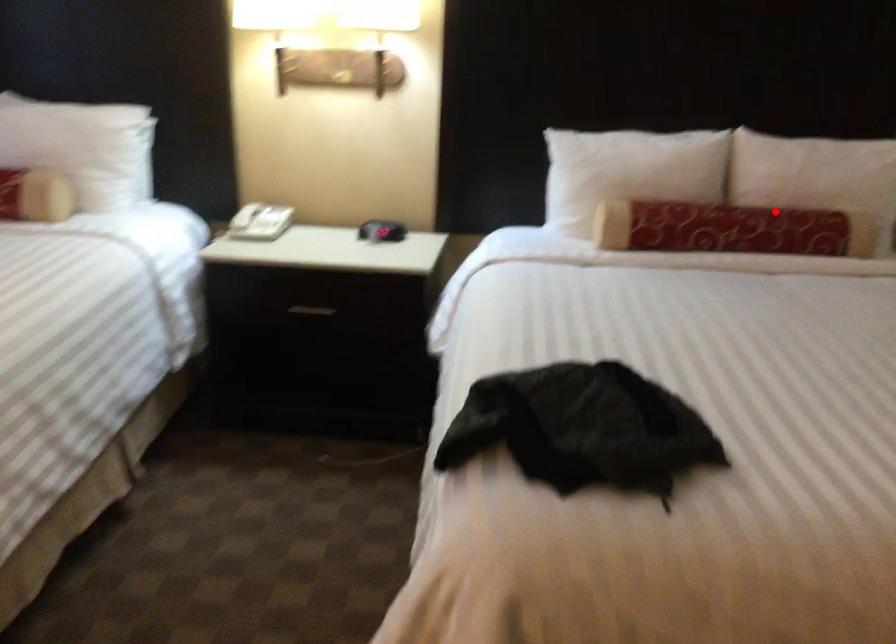
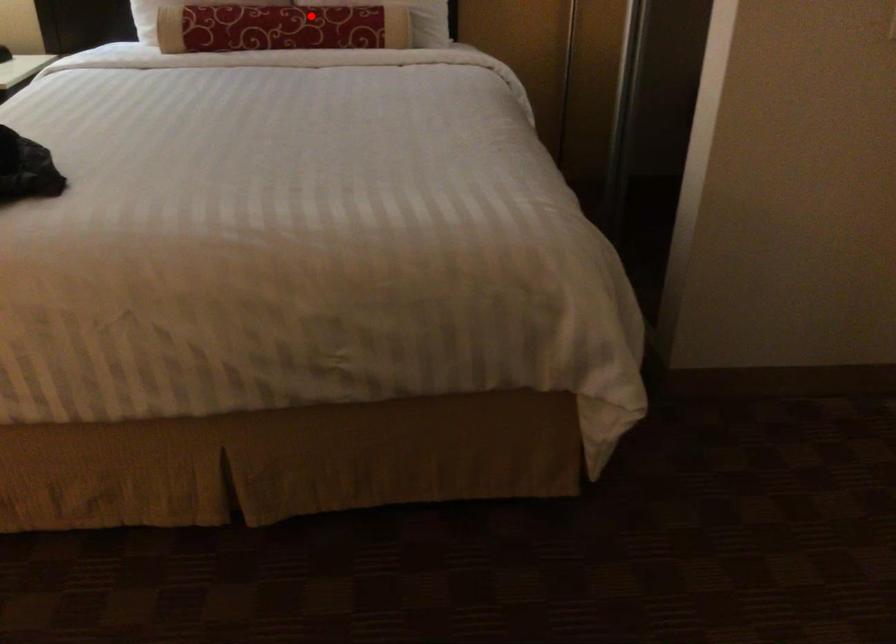
I am providing you with two images of the same scene from different viewpoints. A red point is marked on the first image and another point is marked on the second image. Do the highlighted points in image1 and image2 indicate the same real-world spot?

Yes